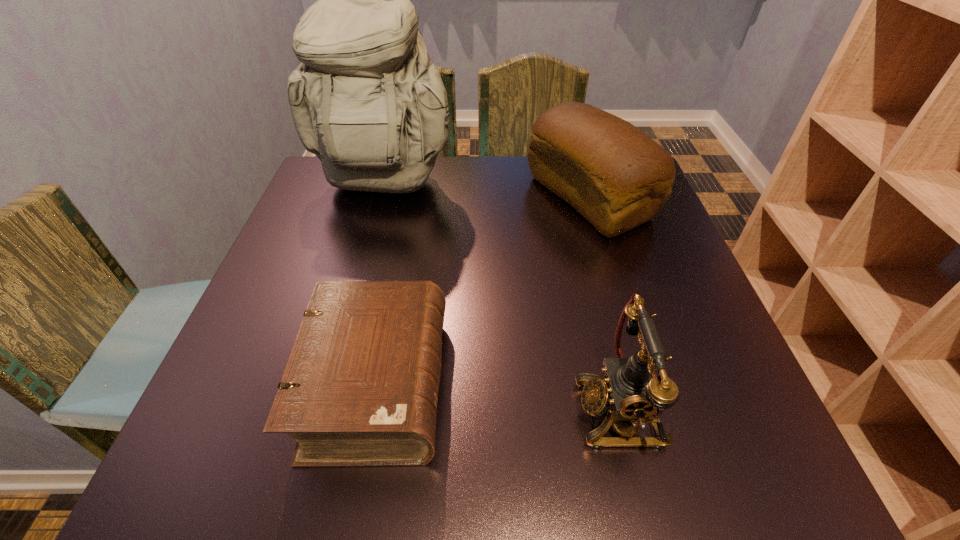
This screenshot has width=960, height=540. I want to click on backpack, so click(367, 100).

The width and height of the screenshot is (960, 540). I want to click on bread, so click(614, 175).

Locate an element on the screen. telephone is located at coordinates (634, 392).

The height and width of the screenshot is (540, 960). I want to click on Bible, so click(x=360, y=388).

Identify the location of vacant space located 0.300m on the front-facing side of the backpack. The width and height of the screenshot is (960, 540). (349, 306).

Locate an element on the screen. Image resolution: width=960 pixels, height=540 pixels. vacant space located 0.080m on the left of the bread is located at coordinates (497, 198).

Where is `free space located on the front of the telephone, featuring the rotary dial`? free space located on the front of the telephone, featuring the rotary dial is located at coordinates (371, 410).

What are the coordinates of `vacant space located on the front of the telephone, featuring the rotary dial` in the screenshot? It's located at tap(529, 410).

I want to click on free space located 0.340m on the front of the telephone, featuring the rotary dial, so click(371, 410).

At what (x,y) coordinates should I click in order to perform the action: click on vacant region located 0.240m on the spine side of the Bible. Please return your answer as a coordinate pair (x, y). Looking at the image, I should click on (584, 386).